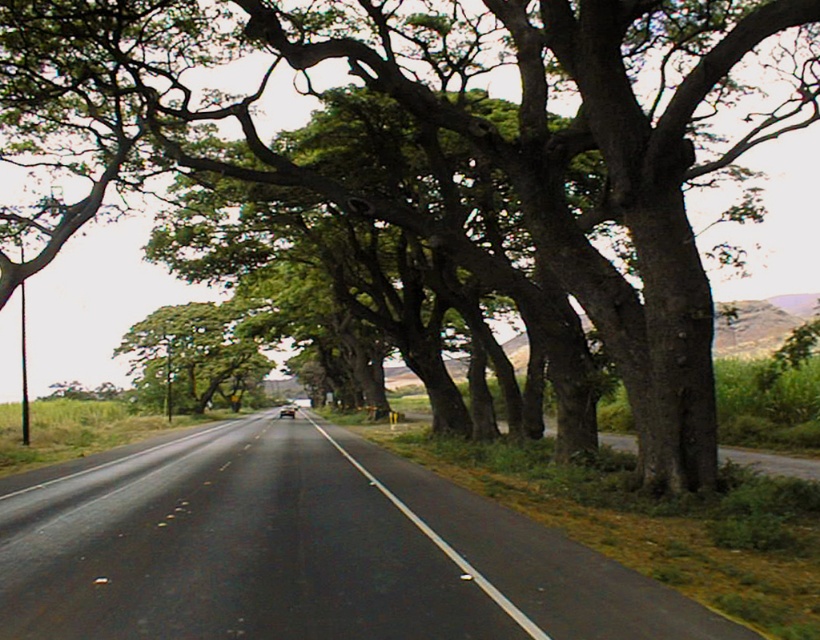
Can you confirm if black asphalt highway at center is bigger than black asphalt road at center?

Indeed, black asphalt highway at center has a larger size compared to black asphalt road at center.

Who is positioned more to the right, black asphalt highway at center or black asphalt road at center?

black asphalt road at center

Does point (71, 563) come behind point (547, 636)?

Yes, it is behind point (547, 636).

This screenshot has width=820, height=640. I want to click on black asphalt highway at center, so click(304, 552).

Is black asphalt highway at center wider than green leafy tree at center?

Incorrect, black asphalt highway at center's width does not surpass green leafy tree at center's.

The image size is (820, 640). Describe the element at coordinates (304, 552) in the screenshot. I see `black asphalt highway at center` at that location.

You are a GUI agent. You are given a task and a screenshot of the screen. Output one action in this format:
    pyautogui.click(x=<x>, y=<y>)
    Task: Click on the black asphalt highway at center
    The height and width of the screenshot is (640, 820).
    Given the screenshot: What is the action you would take?
    pyautogui.click(x=304, y=552)

The image size is (820, 640). What do you see at coordinates (192, 356) in the screenshot?
I see `green leafy tree at center` at bounding box center [192, 356].

Between green leafy tree at center and black asphalt road at center, which one is positioned higher?

green leafy tree at center

Who is more distant from viewer, (254, 360) or (381, 483)?

Point (254, 360)

This screenshot has width=820, height=640. Identify the location of green leafy tree at center. (192, 356).